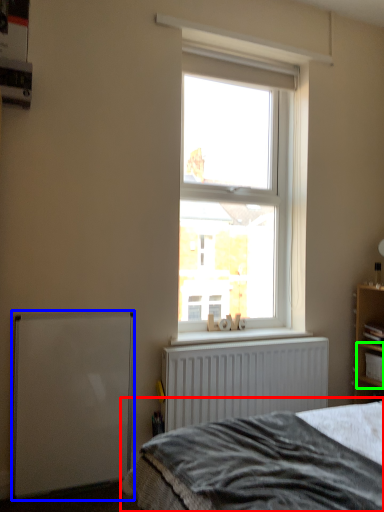
Question: Which object is the farthest from bed (highlighted by a red box)? Choose among these: wide (highlighted by a blue box) or cabinet (highlighted by a green box).

Choices:
 (A) wide
 (B) cabinet

Answer: (B)